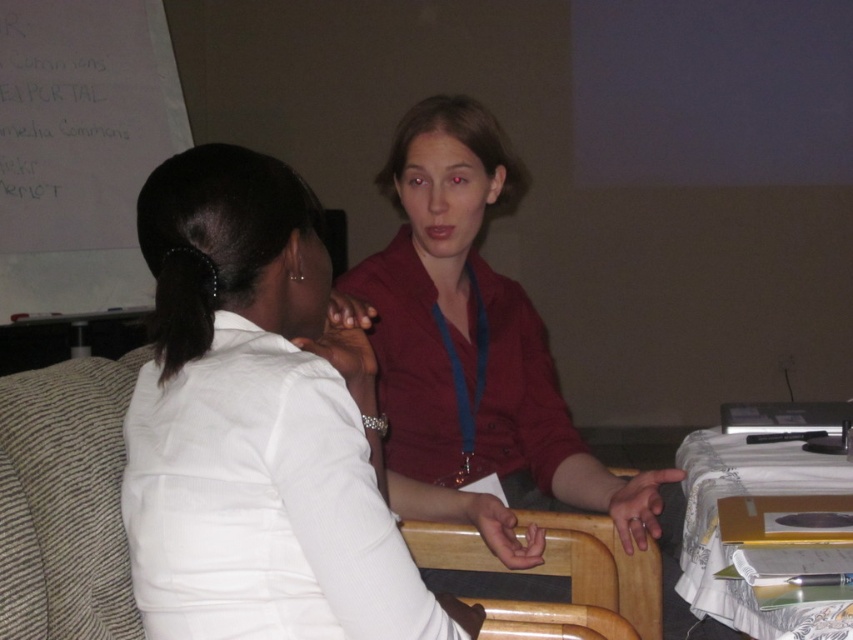
Is white cloth-covered table at lower right smaller than beech wood chair at center?

No.

Between white cloth-covered table at lower right and beech wood chair at center, which one has more height?

Standing taller between the two is white cloth-covered table at lower right.

Is point (769, 611) positioned behind point (519, 538)?

That is False.

Where is `white cloth-covered table at lower right`? The height and width of the screenshot is (640, 853). white cloth-covered table at lower right is located at coordinates (733, 545).

Does matte red blouse at upper center appear on the right side of white cloth-covered table at lower right?

Incorrect, matte red blouse at upper center is not on the right side of white cloth-covered table at lower right.

This screenshot has width=853, height=640. Find the location of `matte red blouse at upper center`. matte red blouse at upper center is located at coordinates (257, 426).

Is point (141, 148) positioned behind point (729, 480)?

Yes.

Who is higher up, white paper at upper left or white cloth-covered table at lower right?

white paper at upper left is higher up.

Who is more forward, (x=138, y=17) or (x=746, y=624)?

Positioned in front is point (x=746, y=624).

Image resolution: width=853 pixels, height=640 pixels. In order to click on white paper at upper left in this screenshot , I will do `click(80, 147)`.